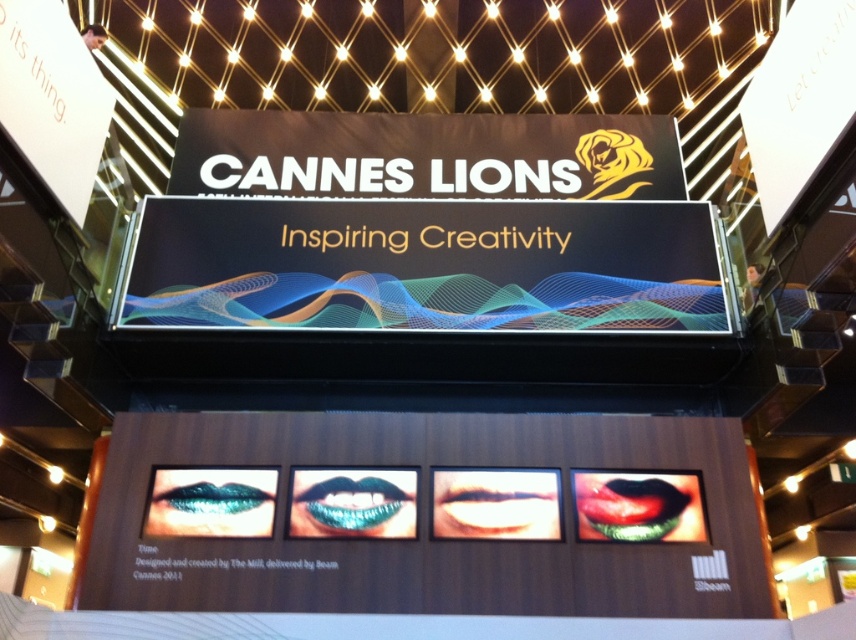
You are a makeup artist attending the Cannes Lions event and want to create a lipstick display that matches the theme of the event. Given the two options shown in the image, the teal glossy lips at center and the shiny metallic mouth at center, which one would you choose to emphasize creativity and why?

The teal glossy lips at center is bigger than the shiny metallic mouth at center, so it would be more effective in emphasizing creativity as it draws more attention due to its larger size.